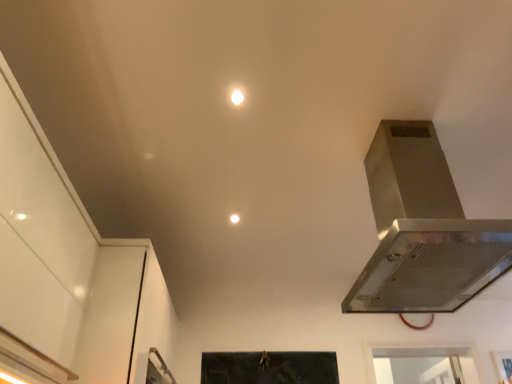
Find the location of a particular element. This screenshot has width=512, height=384. stainless steel vent at upper right is located at coordinates (423, 230).

What do you see at coordinates (423, 230) in the screenshot? The image size is (512, 384). I see `stainless steel vent at upper right` at bounding box center [423, 230].

Locate an element on the screen. The width and height of the screenshot is (512, 384). stainless steel vent at upper right is located at coordinates (423, 230).